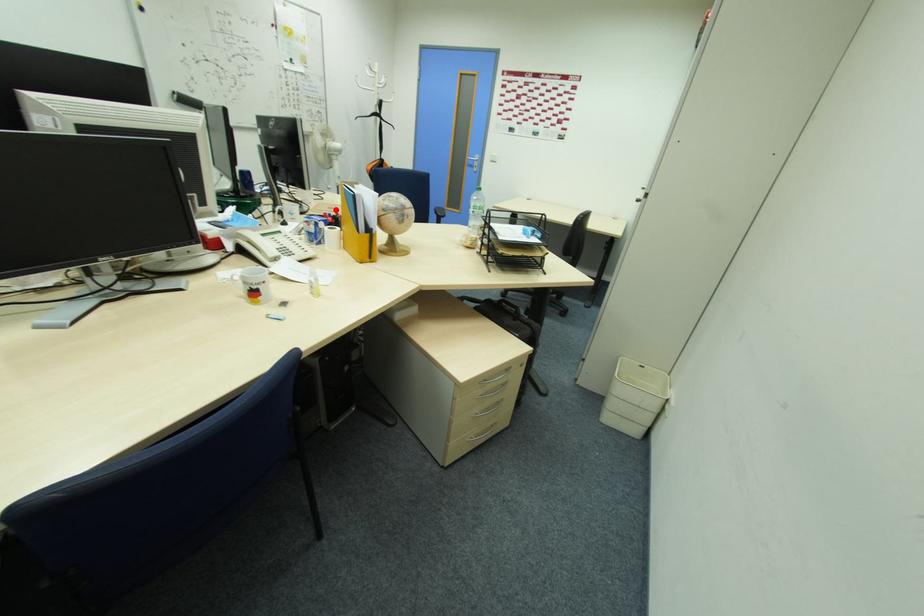
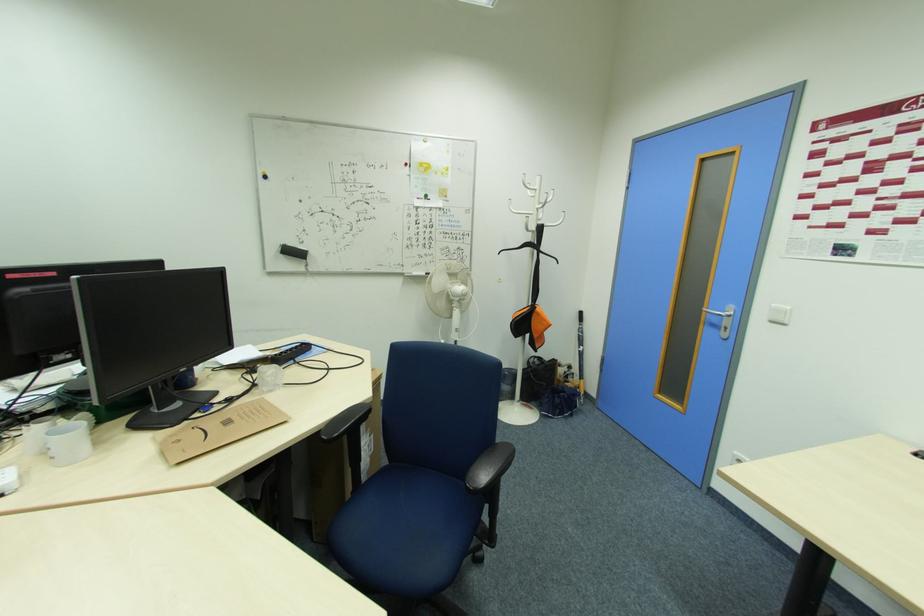
Where in the second image is the point corresponding to the highlighted location from the first image?

(232, 424)